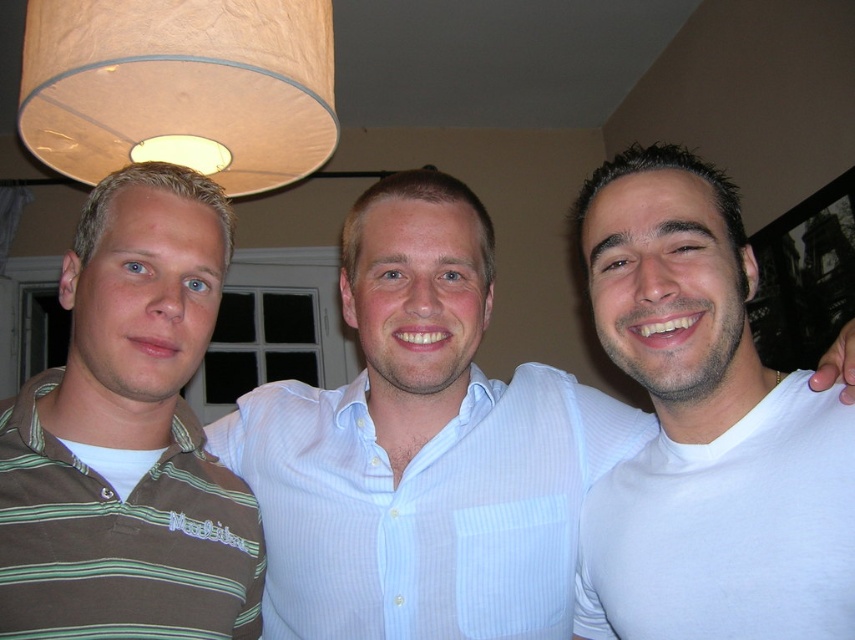
Looking at this image, who is more distant from viewer, (163, 179) or (187, 138)?

The point (187, 138) is more distant.

Who is more forward, (193, 227) or (273, 177)?

Point (193, 227)

Locate an element on the screen. The height and width of the screenshot is (640, 855). brown striped polo shirt at left is located at coordinates (128, 436).

In the scene shown: Between white matte t-shirt at center and brown striped polo shirt at left, which one has less height?

Standing shorter between the two is brown striped polo shirt at left.

Is white matte t-shirt at center above brown striped polo shirt at left?

Correct, white matte t-shirt at center is located above brown striped polo shirt at left.

Image resolution: width=855 pixels, height=640 pixels. What are the coordinates of `white matte t-shirt at center` in the screenshot? It's located at (706, 428).

Find the location of a particular element. This screenshot has height=640, width=855. white matte t-shirt at center is located at coordinates (706, 428).

Which is in front, point (226, 525) or point (470, 573)?

Point (226, 525)

This screenshot has height=640, width=855. Describe the element at coordinates (128, 436) in the screenshot. I see `brown striped polo shirt at left` at that location.

Is point (95, 374) in front of point (497, 461)?

Yes, point (95, 374) is closer to viewer.

In order to click on brown striped polo shirt at left in this screenshot , I will do `click(128, 436)`.